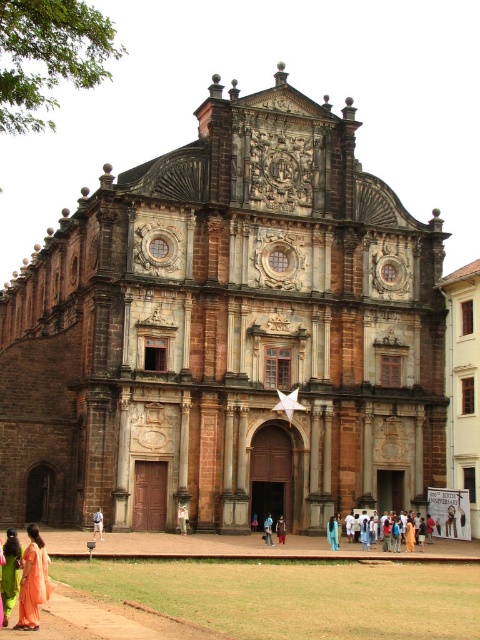
Question: In this image, where is brown stone church at center located relative to silk orange dress at lower left?

Choices:
 (A) left
 (B) right

Answer: (B)

Question: Among these objects, which one is nearest to the camera?

Choices:
 (A) denim pants at center
 (B) blue fabric dress at center

Answer: (A)

Question: Does orange silk saree at lower left appear under light brown wooden stick at center?

Choices:
 (A) no
 (B) yes

Answer: (B)

Question: Observing the image, what is the correct spatial positioning of light beige fabric pants at center in reference to blue fabric dress at center?

Choices:
 (A) left
 (B) right

Answer: (A)

Question: Which is farther from the blue fabric dress at center?

Choices:
 (A) light beige fabric pants at center
 (B) light brown fabric people at center
 (C) denim pants at center
 (D) silk orange dress at lower left

Answer: (D)

Question: Which of these objects is positioned closest to the light brown fabric people at center?

Choices:
 (A) silk orange dress at lower left
 (B) orange silk saree at lower left
 (C) light brown wooden stick at center
 (D) brown stone church at center

Answer: (D)